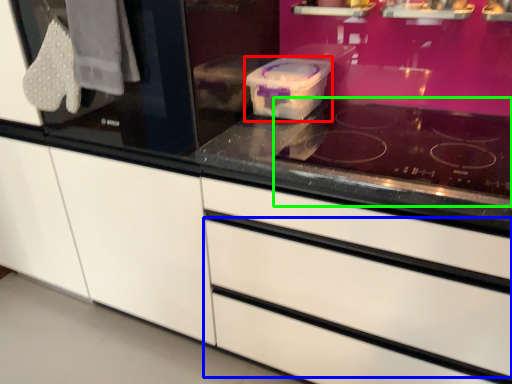
Question: Based on their relative distances, which object is farther from appliance (highlighted by a red box)? Choose from drawer (highlighted by a blue box) and gas stove (highlighted by a green box).

Choices:
 (A) drawer
 (B) gas stove

Answer: (A)